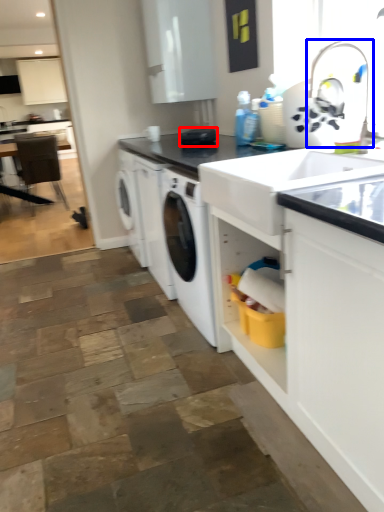
Question: Among these objects, which one is nearest to the camera, appliance (highlighted by a red box) or faucet (highlighted by a blue box)?

Choices:
 (A) appliance
 (B) faucet

Answer: (B)